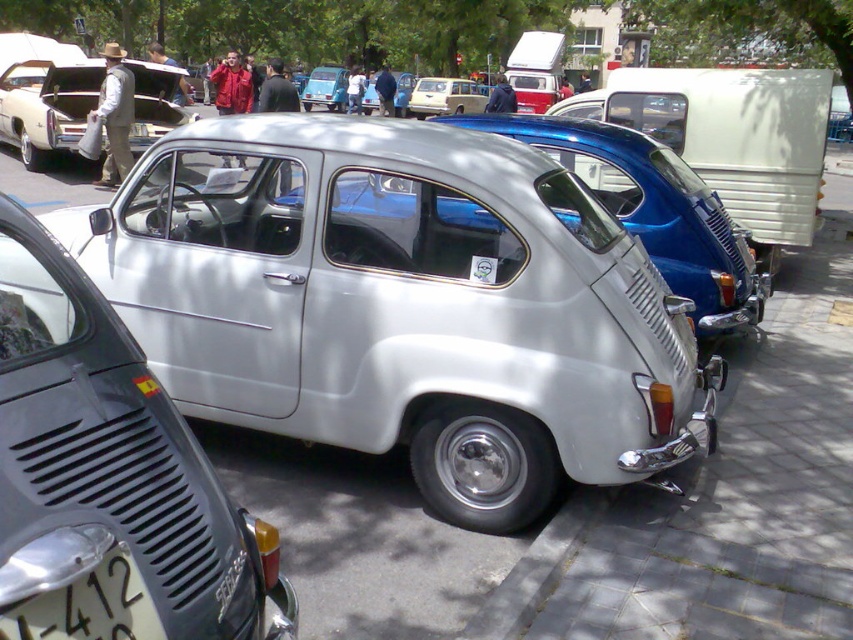
You are at a car show and want to park your compact car between the metallic blue car at center and the matte white car at center. Based on their sizes, which side should you park closer to ensure enough space?

The metallic blue car at center is smaller than the matte white car at center. To ensure enough space, you should park closer to the metallic blue car at center since it takes up less space.

You are standing at the point marked as point (688, 186) and want to walk towards the silver Fiat 500 in the foreground. Will you have to pass by point (834, 504) on your way?

Yes, because point (834, 504) is in front of point (688, 186), so you will pass by it on your way to the silver Fiat 500.

You are a photographer standing at the position of the point marked at coordinates (90, 608). You want to take a photo of the silver Fiat 500. Since you are at the location of the point, which object from the scene should you look towards to capture the silver Fiat 500 in your shot?

The point at (90, 608) is located at the white plastic license plate at lower left. To capture the silver Fiat 500 in your photo, you should look towards the silver Fiat 500 itself, which is the main subject in the foreground.